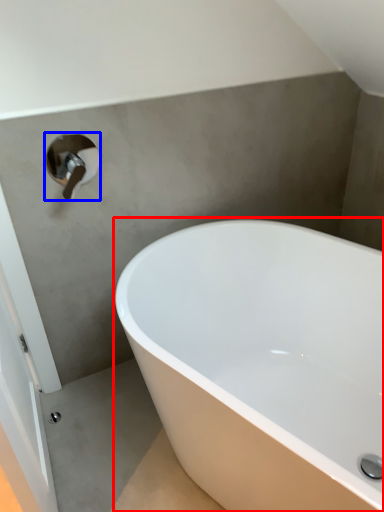
Question: Which of the following is the closest to the observer, bathtub (highlighted by a red box) or tap (highlighted by a blue box)?

Choices:
 (A) bathtub
 (B) tap

Answer: (A)